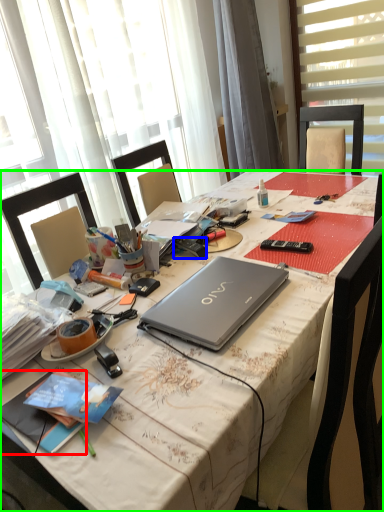
Question: Which object is the farthest from book (highlighted by a red box)? Choose among these: remote control (highlighted by a blue box) or desk (highlighted by a green box).

Choices:
 (A) remote control
 (B) desk

Answer: (A)